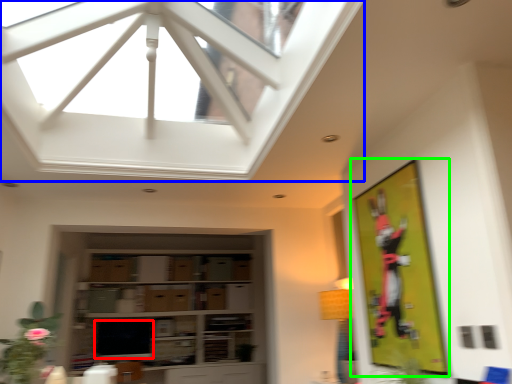
Question: Estimate the real-world distances between objects in this image. Which object is farther from window screen (highlighted by a red box), window (highlighted by a blue box) or bulletin board (highlighted by a green box)?

Choices:
 (A) window
 (B) bulletin board

Answer: (B)